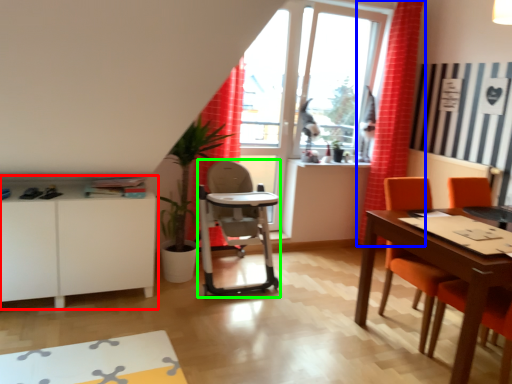
Question: Estimate the real-world distances between objects in this image. Which object is farther from cabinetry (highlighted by a red box), curtain (highlighted by a blue box) or feeding chair (highlighted by a green box)?

Choices:
 (A) curtain
 (B) feeding chair

Answer: (A)